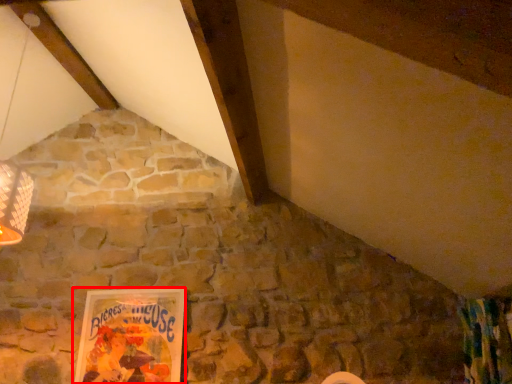
Question: Considering the relative positions of picture frame (annotated by the red box) and curtain in the image provided, where is picture frame (annotated by the red box) located with respect to the staircase?

Choices:
 (A) left
 (B) right

Answer: (A)